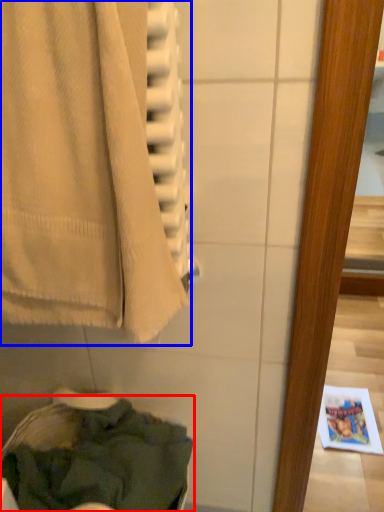
Question: Which of the following is the closest to the observer, clothing (highlighted by a red box) or towel (highlighted by a blue box)?

Choices:
 (A) clothing
 (B) towel

Answer: (B)